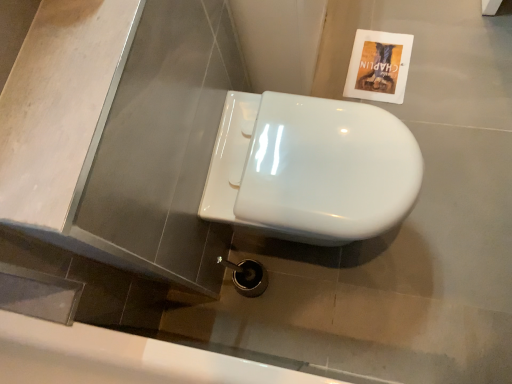
Find the location of a particular element. free space to the left of matte paper flyer at upper right is located at coordinates (331, 73).